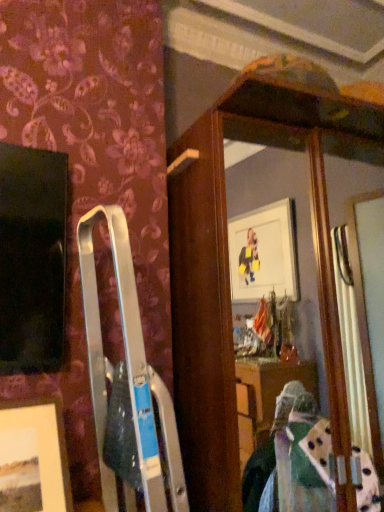
This screenshot has height=512, width=384. Describe the element at coordinates (35, 456) in the screenshot. I see `matte wooden picture frame at lower left` at that location.

Where is `matte wooden picture frame at lower left`? This screenshot has width=384, height=512. matte wooden picture frame at lower left is located at coordinates (35, 456).

The width and height of the screenshot is (384, 512). What are the coordinates of `matte wooden picture frame at lower left` in the screenshot? It's located at (35, 456).